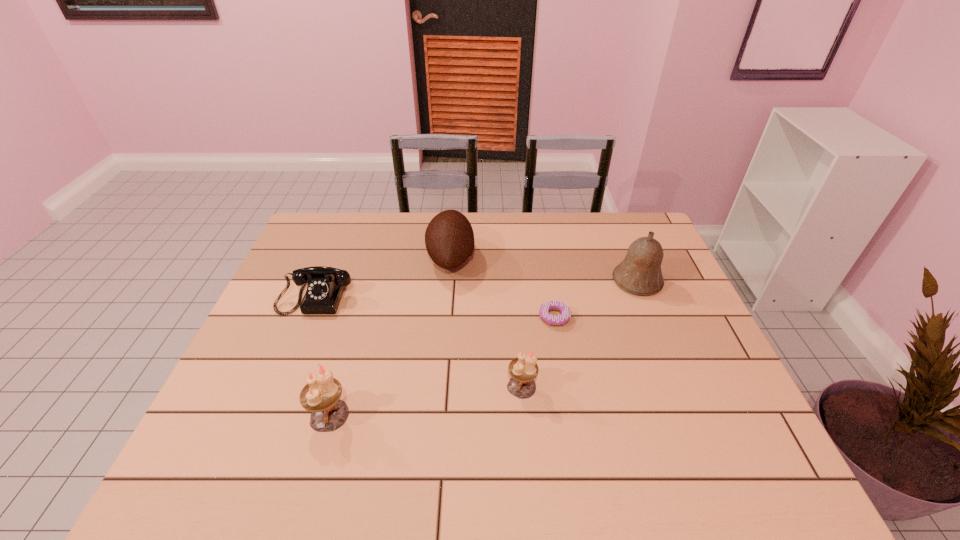
At what (x,y) coordinates should I click in order to perform the action: click on free space between the telephone and the shortest object. Please return your answer as a coordinate pair (x, y). The height and width of the screenshot is (540, 960). Looking at the image, I should click on (437, 306).

Find the location of a particular element. empty space between the rightmost object and the shorter candle holder is located at coordinates (580, 334).

Locate an element on the screen. free area in between the fourth object from right to left and the fifth tallest object is located at coordinates (385, 276).

Point out which object is positioned as the third nearest to the taller candle holder. Please provide its 2D coordinates. Your answer should be formatted as a tuple, i.e. [(x, y)], where the tuple contains the x and y coordinates of a point satisfying the conditions above.

[(449, 238)]

Identify the location of the closest object relative to the second object from right to left. (523, 369).

Where is `free location that satisfies the following two spatial constraints: 1. on the laces of the football; 2. on the front side of the left candle holder`? free location that satisfies the following two spatial constraints: 1. on the laces of the football; 2. on the front side of the left candle holder is located at coordinates (439, 415).

What are the coordinates of `vacant region that satisfies the following two spatial constraints: 1. on the laces of the third object from left to right; 2. on the dial of the fifth tallest object` in the screenshot? It's located at (448, 294).

This screenshot has width=960, height=540. Find the location of `free space that satisfies the following two spatial constraints: 1. on the back side of the fifth object from left to right; 2. on the right side of the bell`. free space that satisfies the following two spatial constraints: 1. on the back side of the fifth object from left to right; 2. on the right side of the bell is located at coordinates (548, 281).

At what (x,y) coordinates should I click in order to perform the action: click on vacant space that satisfies the following two spatial constraints: 1. on the laces of the football; 2. on the left side of the bell. Please return your answer as a coordinate pair (x, y). Looking at the image, I should click on (449, 281).

At what (x,y) coordinates should I click in order to perform the action: click on vacant region that satisfies the following two spatial constraints: 1. on the laces of the doughnut; 2. on the left side of the football. Please return your answer as a coordinate pair (x, y). This screenshot has height=540, width=960. Looking at the image, I should click on (446, 317).